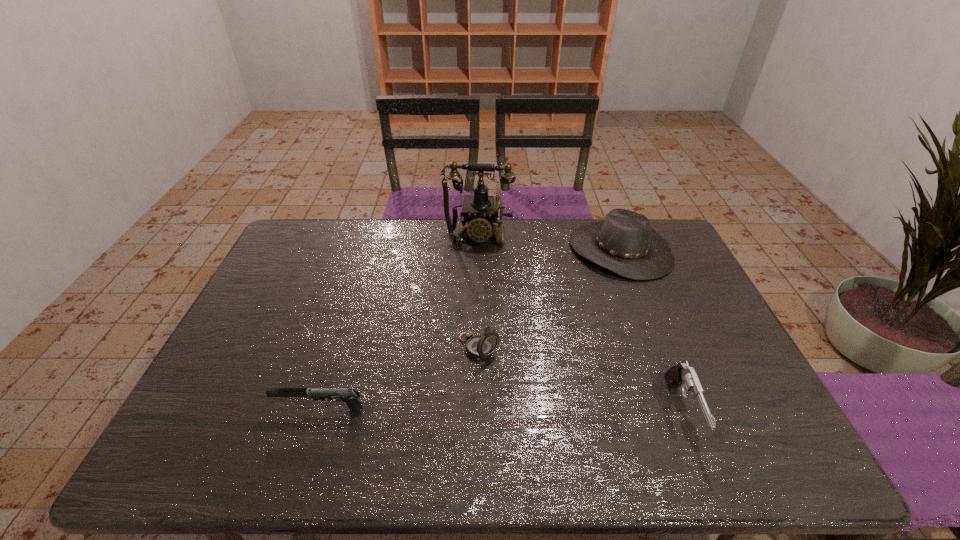
This screenshot has width=960, height=540. Find the location of `vacant space on the desktop that is between the shortest object and the taller gun and is positioned on the rotary dial of the telephone`. vacant space on the desktop that is between the shortest object and the taller gun and is positioned on the rotary dial of the telephone is located at coordinates (457, 410).

This screenshot has width=960, height=540. In order to click on vacant space on the desktop that is between the leftmost object and the taller gun and is positioned on the face of the compass in this screenshot , I will do `click(550, 411)`.

Find the location of a particular element. free spot on the desktop that is between the shortest object and the right gun and is positioned on the front-facing side of the hat is located at coordinates (478, 411).